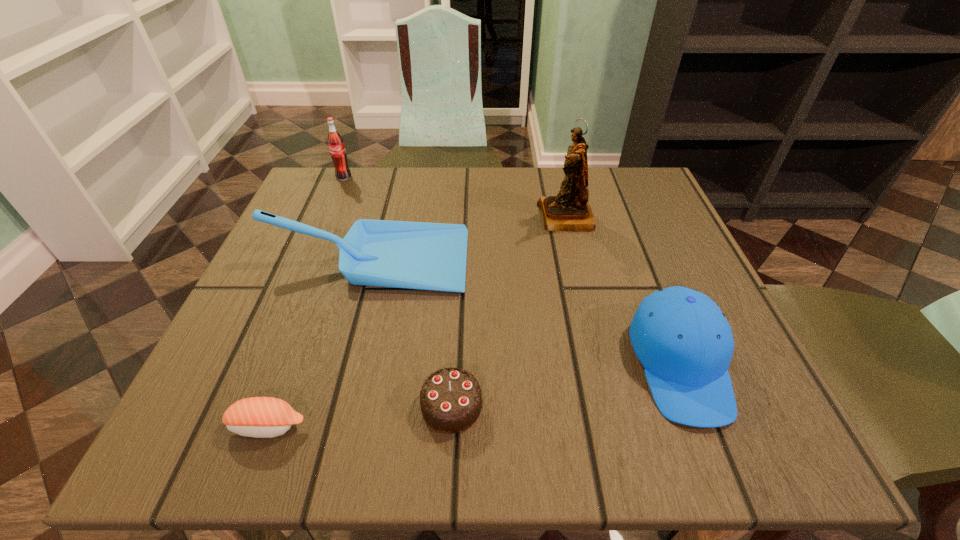
Locate an element on the screen. The width and height of the screenshot is (960, 540). dustpan located in the left edge section of the desktop is located at coordinates (415, 255).

You are a GUI agent. You are given a task and a screenshot of the screen. Output one action in this format:
    pyautogui.click(x=<x>, y=<y>)
    Task: Click on the sushi situated at the left edge
    The height and width of the screenshot is (540, 960).
    Given the screenshot: What is the action you would take?
    pyautogui.click(x=262, y=417)

Locate an element on the screen. The width and height of the screenshot is (960, 540). object that is at the right edge is located at coordinates (684, 342).

The width and height of the screenshot is (960, 540). In order to click on object present at the far left corner in this screenshot , I will do `click(336, 145)`.

You are a GUI agent. You are given a task and a screenshot of the screen. Output one action in this format:
    pyautogui.click(x=<x>, y=<y>)
    Task: Click on the object located at the near left corner
    Image resolution: width=960 pixels, height=540 pixels.
    Given the screenshot: What is the action you would take?
    pyautogui.click(x=262, y=417)

Locate an element on the screen. object present at the near right corner is located at coordinates (684, 342).

In the image, there is a desktop. Where is `vacant space at the far edge`? This screenshot has height=540, width=960. vacant space at the far edge is located at coordinates (517, 178).

You are a GUI agent. You are given a task and a screenshot of the screen. Output one action in this format:
    pyautogui.click(x=<x>, y=<y>)
    Task: Click on the vacant space at the near edge
    The image size is (960, 540).
    Given the screenshot: What is the action you would take?
    pyautogui.click(x=383, y=436)

You are a GUI agent. You are given a task and a screenshot of the screen. Output one action in this format:
    pyautogui.click(x=<x>, y=<y>)
    Task: Click on the free region at the left edge of the desktop
    The image size is (960, 540).
    Given the screenshot: What is the action you would take?
    pyautogui.click(x=251, y=324)

In the image, there is a desktop. Identify the location of free space at the right edge. (643, 262).